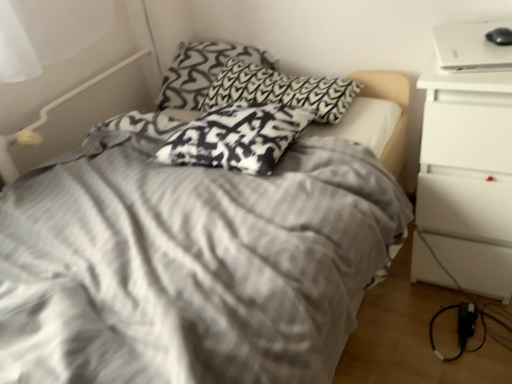
Question: Is black and white patterned pillow at upper center, arranged as the 1th pillow when viewed from the back, aimed at black plastic power adapter at lower right?

Choices:
 (A) yes
 (B) no

Answer: (B)

Question: Is black and white patterned pillow at upper center, arranged as the 1th pillow when viewed from the back, not inside black plastic power adapter at lower right?

Choices:
 (A) yes
 (B) no

Answer: (A)

Question: Is black and white patterned pillow at upper center, the third pillow from the front, positioned far away from black plastic power adapter at lower right?

Choices:
 (A) yes
 (B) no

Answer: (A)

Question: Is black plastic power adapter at lower right at the back of black and white patterned pillow at upper center, the third pillow from the front?

Choices:
 (A) yes
 (B) no

Answer: (B)

Question: Is black and white patterned pillow at upper center, arranged as the 1th pillow when viewed from the back, to the right of black plastic power adapter at lower right from the viewer's perspective?

Choices:
 (A) yes
 (B) no

Answer: (B)

Question: From the image's perspective, is black and white patterned pillow at upper center, arranged as the 1th pillow when viewed from the back, above or below white matte nightstand at right?

Choices:
 (A) below
 (B) above

Answer: (B)

Question: Considering the positions of black and white patterned pillow at upper center, arranged as the 1th pillow when viewed from the back, and white matte nightstand at right in the image, is black and white patterned pillow at upper center, arranged as the 1th pillow when viewed from the back, bigger or smaller than white matte nightstand at right?

Choices:
 (A) big
 (B) small

Answer: (B)

Question: Looking at their shapes, would you say black and white patterned pillow at upper center, arranged as the 1th pillow when viewed from the back, is wider or thinner than white matte nightstand at right?

Choices:
 (A) thin
 (B) wide

Answer: (A)

Question: From a real-world perspective, is black and white patterned pillow at upper center, the third pillow from the front, above or below white matte nightstand at right?

Choices:
 (A) below
 (B) above

Answer: (B)

Question: Is point (449, 36) positioned closer to the camera than point (167, 157)?

Choices:
 (A) farther
 (B) closer

Answer: (A)

Question: From the image's perspective, is white glossy laptop at upper right above or below black and white patterned pillow at center, acting as the 3th pillow starting from the back?

Choices:
 (A) below
 (B) above

Answer: (B)

Question: Is white glossy laptop at upper right wider or thinner than black and white patterned pillow at center, acting as the 3th pillow starting from the back?

Choices:
 (A) thin
 (B) wide

Answer: (B)

Question: Considering the positions of white glossy laptop at upper right and black and white patterned pillow at center, the first pillow when ordered from front to back, in the image, is white glossy laptop at upper right taller or shorter than black and white patterned pillow at center, the first pillow when ordered from front to back,?

Choices:
 (A) short
 (B) tall

Answer: (A)

Question: Relative to white matte nightstand at right, is white glossy laptop at upper right in front or behind?

Choices:
 (A) behind
 (B) front

Answer: (A)

Question: Is white glossy laptop at upper right inside the boundaries of white matte nightstand at right, or outside?

Choices:
 (A) outside
 (B) inside

Answer: (A)